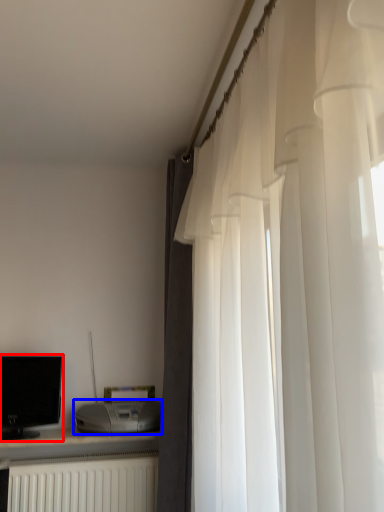
Question: Among these objects, which one is farthest to the camera, computer monitor (highlighted by a red box) or appliance (highlighted by a blue box)?

Choices:
 (A) computer monitor
 (B) appliance

Answer: (A)